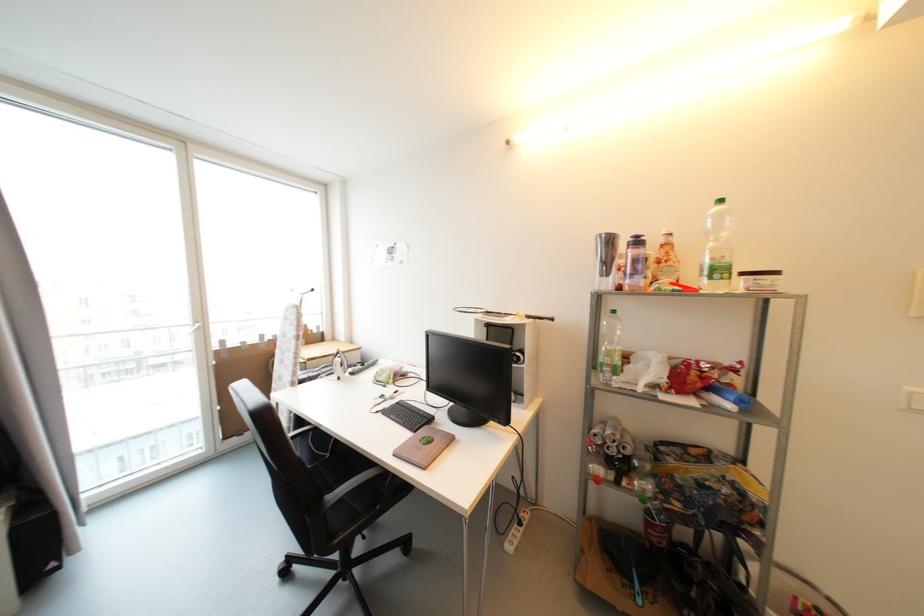
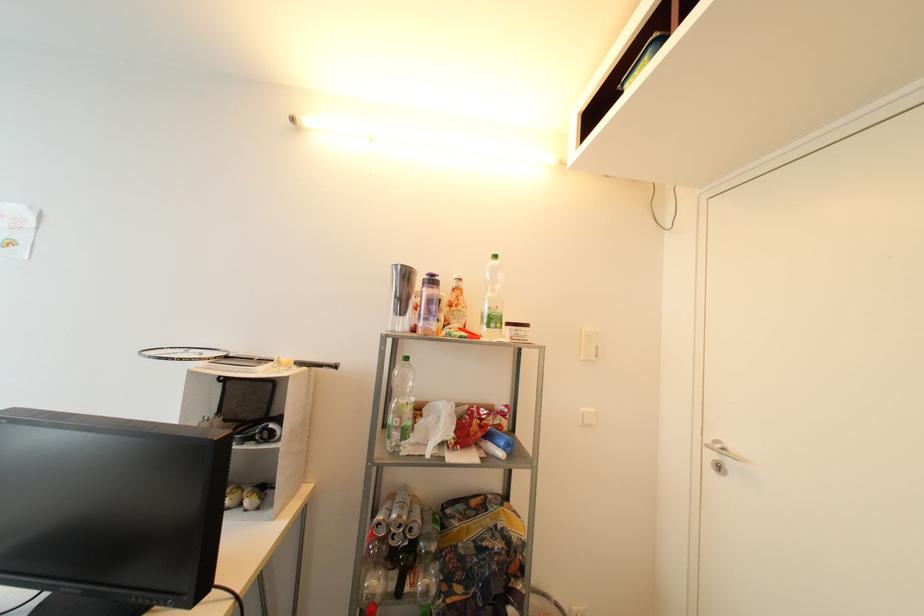
Find the pixel in the second image that matches point (642, 244) in the first image.

(438, 283)